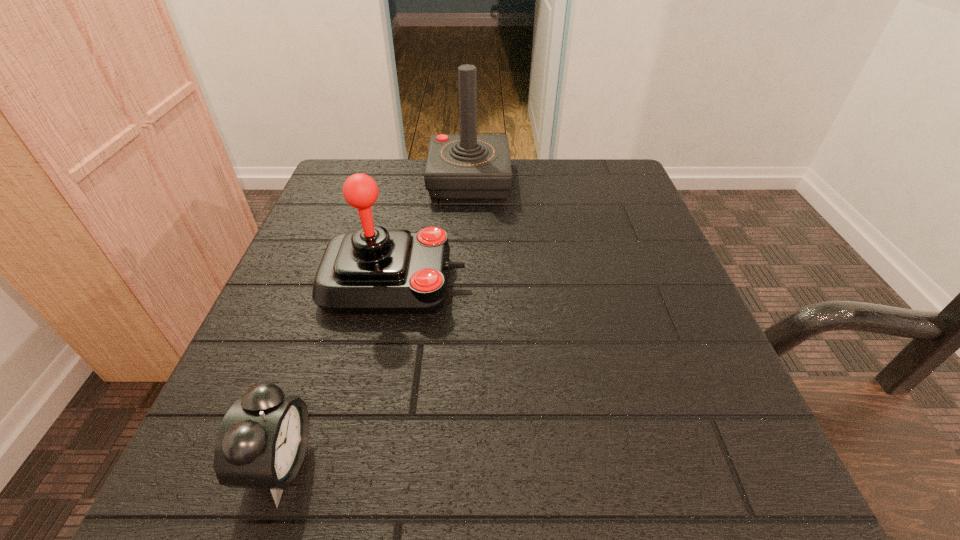
Locate an element on the screen. The width and height of the screenshot is (960, 540). the tallest object is located at coordinates (468, 166).

At what (x,y) coordinates should I click in order to perform the action: click on the taller joystick. Please return your answer as a coordinate pair (x, y). Looking at the image, I should click on (468, 166).

Identify the location of the second shortest object. (371, 270).

Image resolution: width=960 pixels, height=540 pixels. Find the location of `the shorter joystick`. the shorter joystick is located at coordinates (371, 270).

Identify the location of the shortest object. The height and width of the screenshot is (540, 960). (261, 444).

This screenshot has width=960, height=540. Identify the location of alarm clock. (261, 444).

Identify the location of vacant space located 0.380m on the rectangular base of the farthest object. The image size is (960, 540). (464, 336).

Where is `vacant space located on the base of the second shortest object`? This screenshot has height=540, width=960. vacant space located on the base of the second shortest object is located at coordinates (505, 282).

This screenshot has width=960, height=540. Find the location of `vacant space situated on the front side of the nearest object`. vacant space situated on the front side of the nearest object is located at coordinates (492, 463).

I want to click on object present at the far edge, so (468, 166).